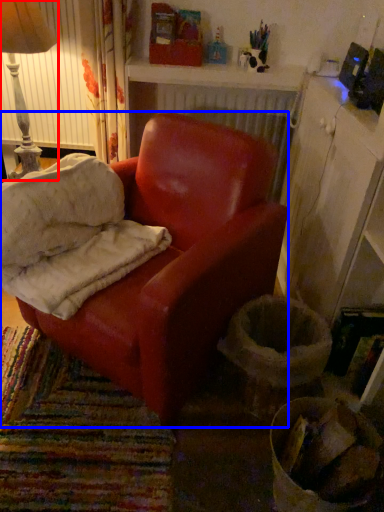
Question: Which object appears closest to the camera in this image, lamp (highlighted by a red box) or chair (highlighted by a blue box)?

Choices:
 (A) lamp
 (B) chair

Answer: (B)